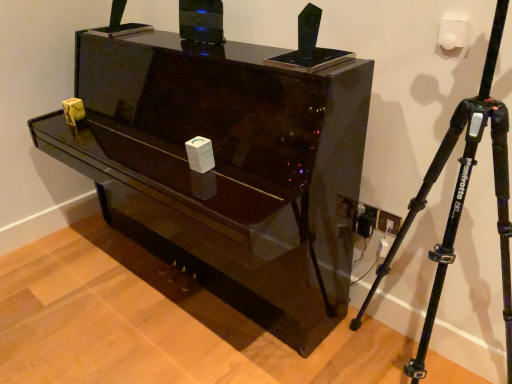
Locate an element on the screen. The height and width of the screenshot is (384, 512). vacant space underneath glossy black piano at center (from a real-world perspective) is located at coordinates (161, 289).